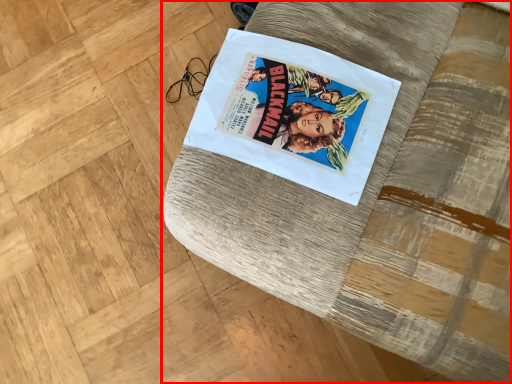
Question: From the image's perspective, considering the relative positions of furniture (annotated by the red box) and paperback book in the image provided, where is furniture (annotated by the red box) located with respect to the staircase?

Choices:
 (A) below
 (B) above

Answer: (A)